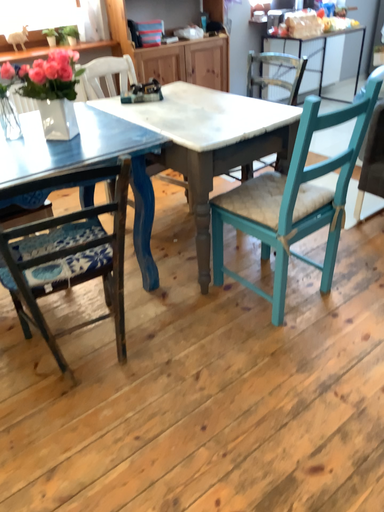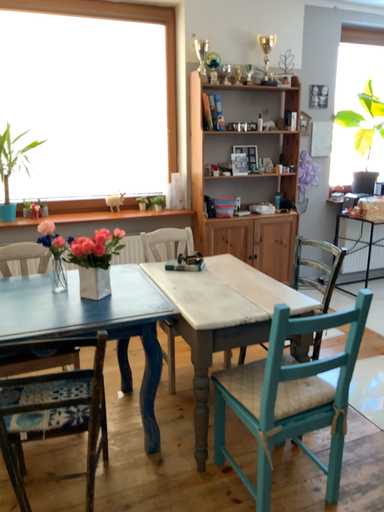
Question: Which way did the camera rotate in the video?

Choices:
 (A) rotated right
 (B) rotated left

Answer: (B)